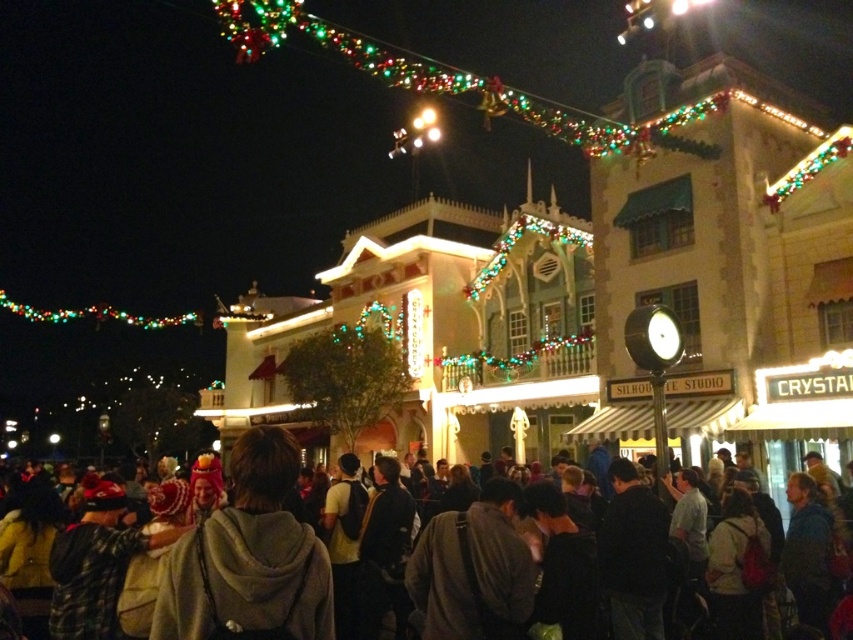
Question: Among these objects, which one is farthest from the camera?

Choices:
 (A) multicolored string lights at upper center
 (B) light brown hoodie at center
 (C) dark gray hoodie at center

Answer: (A)

Question: Which of the following is the closest to the observer?

Choices:
 (A) light brown hoodie at center
 (B) multicolored string lights at upper center

Answer: (A)

Question: Is light brown hoodie at center bigger than dark gray hoodie at center?

Choices:
 (A) yes
 (B) no

Answer: (B)

Question: Which of the following is the closest to the observer?

Choices:
 (A) dark gray hoodie at center
 (B) light brown hoodie at center
 (C) multicolored string lights at upper center

Answer: (B)

Question: Is light brown hoodie at center positioned behind dark gray hoodie at center?

Choices:
 (A) no
 (B) yes

Answer: (A)

Question: Is light brown hoodie at center behind dark gray hoodie at center?

Choices:
 (A) no
 (B) yes

Answer: (A)